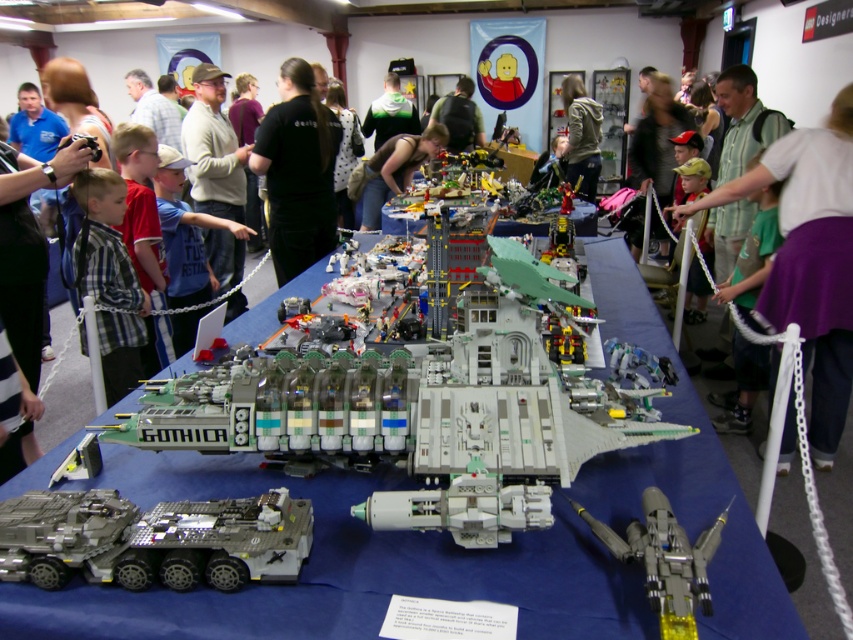
Image resolution: width=853 pixels, height=640 pixels. What do you see at coordinates (297, 172) in the screenshot? I see `black shirt at center` at bounding box center [297, 172].

Which is in front, point (296, 180) or point (119, 384)?

Positioned in front is point (119, 384).

Locate an element on the screen. This screenshot has height=640, width=853. black shirt at center is located at coordinates (297, 172).

Measure the distance between matte gray spaceship at center and camera.

The distance of matte gray spaceship at center from camera is 1.05 meters.

Is matte gray spaceship at center wider than matte black shirt at center?

Yes, matte gray spaceship at center is wider than matte black shirt at center.

What do you see at coordinates (339, 566) in the screenshot? The width and height of the screenshot is (853, 640). I see `matte gray spaceship at center` at bounding box center [339, 566].

The image size is (853, 640). In order to click on matte gray spaceship at center in this screenshot , I will do `click(339, 566)`.

Can you confirm if shiny metallic tank at center is bigger than black shirt at center?

No.

Is point (15, 518) less distant than point (271, 188)?

That is True.

What do you see at coordinates (154, 540) in the screenshot? I see `shiny metallic tank at center` at bounding box center [154, 540].

This screenshot has width=853, height=640. Find the location of `shiny metallic tank at center`. shiny metallic tank at center is located at coordinates (154, 540).